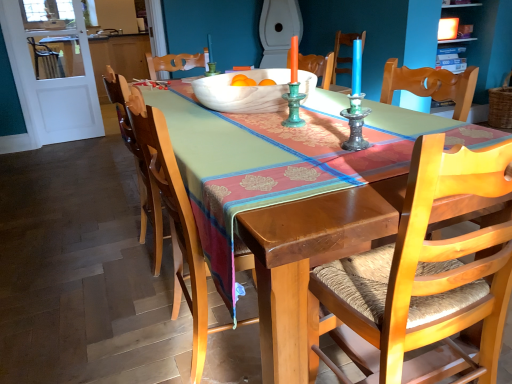
Find the location of a particular element. white glossy toilet at upper center is located at coordinates (278, 30).

This screenshot has width=512, height=384. What do you see at coordinates (208, 173) in the screenshot?
I see `wooden chair with woven seat at center, the second chair from the right` at bounding box center [208, 173].

What are the coordinates of `white glossy toilet at upper center` in the screenshot? It's located at (278, 30).

Considering the relative sizes of wooden chair with woven seat at center, which is the 1th chair in right-to-left order, and wooden chair with woven seat at center, the second chair from the right, in the image provided, is wooden chair with woven seat at center, which is the 1th chair in right-to-left order, wider than wooden chair with woven seat at center, the second chair from the right,?

Yes, wooden chair with woven seat at center, which is the 1th chair in right-to-left order, is wider than wooden chair with woven seat at center, the second chair from the right.

Looking at the image, does wooden chair with woven seat at center, which is the second chair from left to right, seem bigger or smaller compared to wooden chair with woven seat at center, the second chair from the right?

wooden chair with woven seat at center, which is the second chair from left to right, is smaller than wooden chair with woven seat at center, the second chair from the right.

From the image's perspective, is wooden chair with woven seat at center, which is the second chair from left to right, located above or below wooden chair with woven seat at center, which ranks as the first chair in left-to-right order?

wooden chair with woven seat at center, which is the second chair from left to right, is situated lower than wooden chair with woven seat at center, which ranks as the first chair in left-to-right order, in the image.

Who is taller, wooden chair with woven seat at center, which is the 1th chair in right-to-left order, or wooden chair with woven seat at center, which ranks as the first chair in left-to-right order?

wooden chair with woven seat at center, which ranks as the first chair in left-to-right order.

In terms of width, does wooden chair with woven seat at center, which ranks as the first chair in left-to-right order, look wider or thinner when compared to white marble bowl at center?

Considering their sizes, wooden chair with woven seat at center, which ranks as the first chair in left-to-right order, looks slimmer than white marble bowl at center.

Who is bigger, wooden chair with woven seat at center, the second chair from the right, or white marble bowl at center?

wooden chair with woven seat at center, the second chair from the right, is bigger.

Is point (234, 126) farther from viewer compared to point (311, 82)?

No.

Considering the positions of points (203, 223) and (288, 48), is point (203, 223) closer to camera compared to point (288, 48)?

Yes, point (203, 223) is in front of point (288, 48).

From a real-world perspective, who is located higher, wooden chair with woven seat at center, which ranks as the first chair in left-to-right order, or white glossy toilet at upper center?

From a 3D spatial view, white glossy toilet at upper center is above.

From the image's perspective, is wooden chair with woven seat at center, the second chair from the right, above or below white glossy toilet at upper center?

wooden chair with woven seat at center, the second chair from the right, is below white glossy toilet at upper center.

From the image's perspective, does white glossy toilet at upper center appear lower than white marble bowl at center?

Actually, white glossy toilet at upper center appears above white marble bowl at center in the image.

Could you tell me if white glossy toilet at upper center is facing white marble bowl at center?

No, white glossy toilet at upper center is not facing towards white marble bowl at center.

Does white glossy toilet at upper center contain white marble bowl at center?

No, white glossy toilet at upper center does not contain white marble bowl at center.

Between white glossy toilet at upper center and white marble bowl at center, which one has smaller size?

With smaller size is white marble bowl at center.

Which object is thinner, white marble bowl at center or white glossy toilet at upper center?

Thinner between the two is white marble bowl at center.

Which point is more forward, [280,90] or [273,21]?

The point [280,90] is in front.

In the image, is white marble bowl at center on the left side or the right side of white glossy toilet at upper center?

Clearly, white marble bowl at center is on the left of white glossy toilet at upper center in the image.

Would you consider white marble bowl at center to be distant from white glossy toilet at upper center?

white marble bowl at center is far away from white glossy toilet at upper center.

Which object is positioned more to the right, white marble bowl at center or wooden chair with woven seat at center, which is the 1th chair in right-to-left order?

Positioned to the right is wooden chair with woven seat at center, which is the 1th chair in right-to-left order.

How far apart are white marble bowl at center and wooden chair with woven seat at center, which is the second chair from left to right?

white marble bowl at center is 33.51 inches from wooden chair with woven seat at center, which is the second chair from left to right.

Find the location of a particular element. This screenshot has width=512, height=384. chair that is the 1st one below the white marble bowl at center (from a real-world perspective) is located at coordinates (429, 275).

From the image's perspective, is white marble bowl at center above wooden chair with woven seat at center, which is the 1th chair in right-to-left order?

Correct, white marble bowl at center appears higher than wooden chair with woven seat at center, which is the 1th chair in right-to-left order, in the image.

From a real-world perspective, is wooden chair with woven seat at center, which ranks as the first chair in left-to-right order, physically below wooden chair with woven seat at center, which is the 1th chair in right-to-left order?

Indeed, from a real-world perspective, wooden chair with woven seat at center, which ranks as the first chair in left-to-right order, is positioned beneath wooden chair with woven seat at center, which is the 1th chair in right-to-left order.

Considering the positions of objects wooden chair with woven seat at center, which ranks as the first chair in left-to-right order, and wooden chair with woven seat at center, which is the second chair from left to right, in the image provided, who is in front, wooden chair with woven seat at center, which ranks as the first chair in left-to-right order, or wooden chair with woven seat at center, which is the second chair from left to right,?

wooden chair with woven seat at center, which is the second chair from left to right, is more forward.

This screenshot has width=512, height=384. In order to click on chair on the left of wooden chair with woven seat at center, which is the 1th chair in right-to-left order in this screenshot , I will do `click(208, 173)`.

Is wooden chair with woven seat at center, which ranks as the first chair in left-to-right order, to the left of wooden chair with woven seat at center, which is the second chair from left to right, from the viewer's perspective?

Yes.

Where is `chair directly beneath the wooden chair with woven seat at center, which is the second chair from left to right (from a real-world perspective)`? chair directly beneath the wooden chair with woven seat at center, which is the second chair from left to right (from a real-world perspective) is located at coordinates (208, 173).

Where is `bowl above the wooden chair with woven seat at center, the second chair from the right (from the image's perspective)`? The image size is (512, 384). bowl above the wooden chair with woven seat at center, the second chair from the right (from the image's perspective) is located at coordinates (244, 92).

Based on their spatial positions, is white glossy toilet at upper center or wooden chair with woven seat at center, which is the second chair from left to right, closer to wooden chair with woven seat at center, the second chair from the right?

The object closer to wooden chair with woven seat at center, the second chair from the right, is wooden chair with woven seat at center, which is the second chair from left to right.

Based on their spatial positions, is wooden chair with woven seat at center, which is the 1th chair in right-to-left order, or white marble bowl at center closer to wooden chair with woven seat at center, which ranks as the first chair in left-to-right order?

The object closer to wooden chair with woven seat at center, which ranks as the first chair in left-to-right order, is white marble bowl at center.

In the scene shown: From the image, which object appears to be farther from white marble bowl at center, wooden chair with woven seat at center, which ranks as the first chair in left-to-right order, or white glossy toilet at upper center?

white glossy toilet at upper center is further to white marble bowl at center.

When comparing their distances from white marble bowl at center, does wooden chair with woven seat at center, which ranks as the first chair in left-to-right order, or wooden chair with woven seat at center, which is the 1th chair in right-to-left order, seem further?

wooden chair with woven seat at center, which is the 1th chair in right-to-left order, lies further to white marble bowl at center than the other object.

When comparing their distances from white glossy toilet at upper center, does white marble bowl at center or wooden chair with woven seat at center, which ranks as the first chair in left-to-right order, seem further?

wooden chair with woven seat at center, which ranks as the first chair in left-to-right order.

Estimate the real-world distances between objects in this image. Which object is closer to white glossy toilet at upper center, wooden chair with woven seat at center, which is the second chair from left to right, or white marble bowl at center?

white marble bowl at center.

From the image, which object appears to be farther from white marble bowl at center, white glossy toilet at upper center or wooden chair with woven seat at center, the second chair from the right?

A: white glossy toilet at upper center is further to white marble bowl at center.

Based on their spatial positions, is wooden chair with woven seat at center, which is the second chair from left to right, or wooden chair with woven seat at center, the second chair from the right, further from white glossy toilet at upper center?

wooden chair with woven seat at center, which is the second chair from left to right.

The image size is (512, 384). Identify the location of bowl between wooden chair with woven seat at center, which ranks as the first chair in left-to-right order, and white glossy toilet at upper center from front to back. (244, 92).

You are a GUI agent. You are given a task and a screenshot of the screen. Output one action in this format:
    pyautogui.click(x=<x>, y=<y>)
    Task: Click on the chair between wooden chair with woven seat at center, which is the second chair from left to right, and white glossy toilet at upper center, along the z-axis
    
    Given the screenshot: What is the action you would take?
    pyautogui.click(x=208, y=173)

Where is `chair between wooden chair with woven seat at center, which is the second chair from left to right, and white marble bowl at center from front to back`? chair between wooden chair with woven seat at center, which is the second chair from left to right, and white marble bowl at center from front to back is located at coordinates (208, 173).

The height and width of the screenshot is (384, 512). I want to click on bowl positioned between wooden chair with woven seat at center, which is the 1th chair in right-to-left order, and white glossy toilet at upper center from near to far, so tap(244, 92).